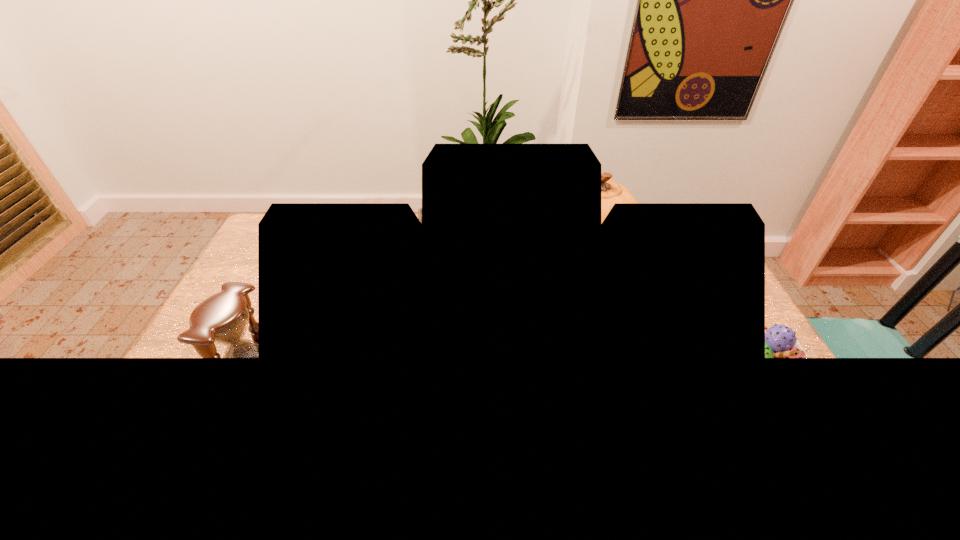
What are the coordinates of `free space between the hourglass and the second object from left to right` in the screenshot? It's located at (346, 320).

This screenshot has width=960, height=540. Identify the location of free space between the third object from left to right and the shortest object. (670, 311).

The width and height of the screenshot is (960, 540). What are the coordinates of `free space between the phonograph_record and the shortest object` in the screenshot? It's located at (597, 322).

Identify the location of vacant space that is in between the third object from right to left and the leftmost object. The width and height of the screenshot is (960, 540). (346, 320).

Image resolution: width=960 pixels, height=540 pixels. I want to click on vacant area that lies between the tallest object and the leftmost object, so click(x=419, y=309).

Where is `object that is the second closest to the icecream`? object that is the second closest to the icecream is located at coordinates (419, 210).

Locate an element on the screen. the closest object to the phonograph_record is located at coordinates (611, 192).

Locate an element on the screen. Image resolution: width=960 pixels, height=540 pixels. free point that satisfies the following two spatial constraints: 1. on the back side of the pumpkin; 2. on the right side of the phonograph_record is located at coordinates (443, 247).